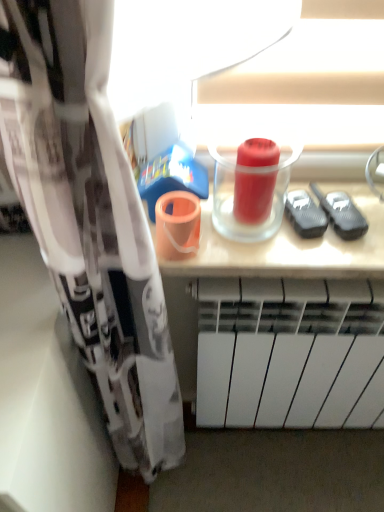
Question: Considering their positions, is red matte cup at center located in front of or behind white matte radiator at lower center?

Choices:
 (A) front
 (B) behind

Answer: (A)

Question: From the image's perspective, is red matte cup at center located above or below white matte radiator at lower center?

Choices:
 (A) below
 (B) above

Answer: (B)

Question: Looking at the image, does red matte cup at center seem bigger or smaller compared to white matte radiator at lower center?

Choices:
 (A) big
 (B) small

Answer: (B)

Question: From the image's perspective, is white matte radiator at lower center above or below red matte cup at center?

Choices:
 (A) below
 (B) above

Answer: (A)

Question: Which is correct: white matte radiator at lower center is inside red matte cup at center, or outside of it?

Choices:
 (A) inside
 (B) outside

Answer: (B)

Question: From a real-world perspective, is white matte radiator at lower center positioned above or below red matte cup at center?

Choices:
 (A) below
 (B) above

Answer: (A)

Question: Considering the positions of white matte radiator at lower center and red matte cup at center in the image, is white matte radiator at lower center wider or thinner than red matte cup at center?

Choices:
 (A) wide
 (B) thin

Answer: (A)